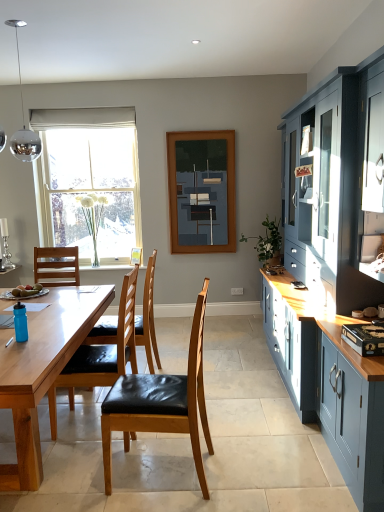
I want to click on free space to the right of matte black plate at table left, so click(x=51, y=294).